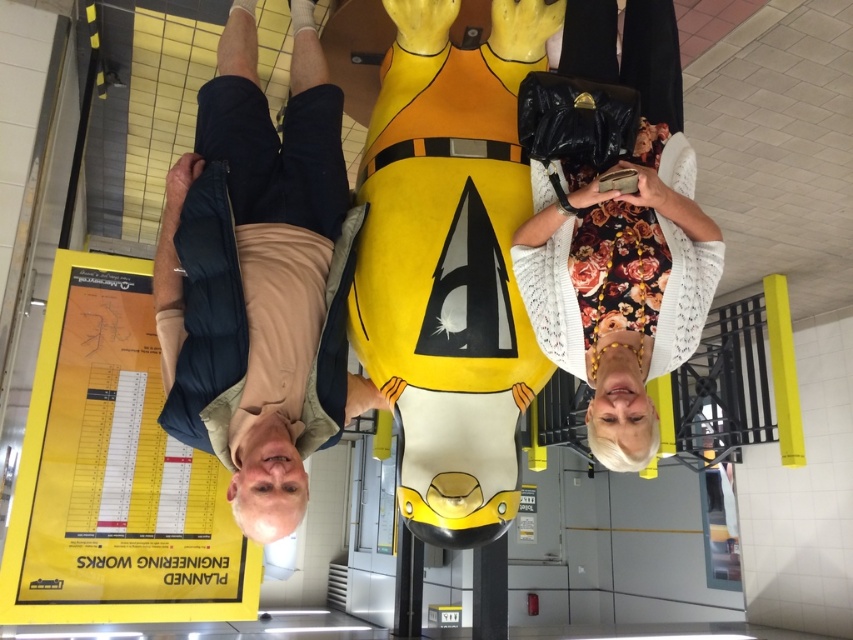
Question: Is yellow paper poster at lower left smaller than floral dress at center?

Choices:
 (A) no
 (B) yes

Answer: (B)

Question: Can you confirm if beige fabric shirt at center is smaller than floral dress at center?

Choices:
 (A) yes
 (B) no

Answer: (B)

Question: Which is farther from the floral dress at center?

Choices:
 (A) beige fabric shirt at center
 (B) yellow paper poster at lower left

Answer: (B)

Question: Does yellow paper poster at lower left have a larger size compared to beige fabric shirt at center?

Choices:
 (A) yes
 (B) no

Answer: (B)

Question: Which object appears farthest from the camera in this image?

Choices:
 (A) beige fabric shirt at center
 (B) yellow paper poster at lower left

Answer: (B)

Question: Which object appears closest to the camera in this image?

Choices:
 (A) yellow paper poster at lower left
 (B) floral dress at center

Answer: (B)